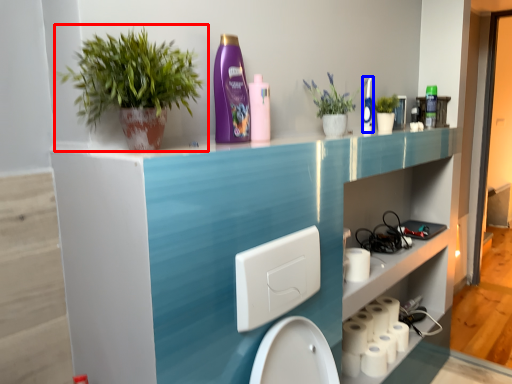
Question: Which object is further to the camera taking this photo, houseplant (highlighted by a red box) or cleaning product (highlighted by a blue box)?

Choices:
 (A) houseplant
 (B) cleaning product

Answer: (B)